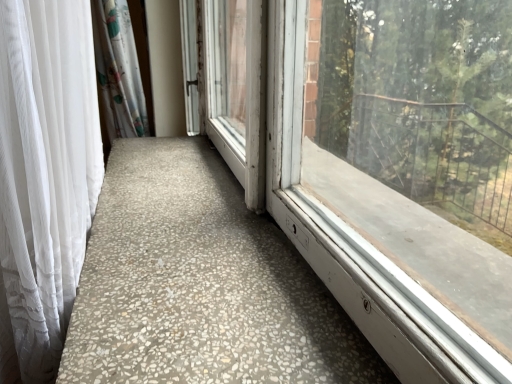
You are a GUI agent. You are given a task and a screenshot of the screen. Output one action in this format:
    pyautogui.click(x=<x>, y=<y>)
    Task: Click on the free spot above speckled concrete floor at center (from a real-world perspective)
    The height and width of the screenshot is (384, 512).
    Given the screenshot: What is the action you would take?
    pyautogui.click(x=195, y=195)